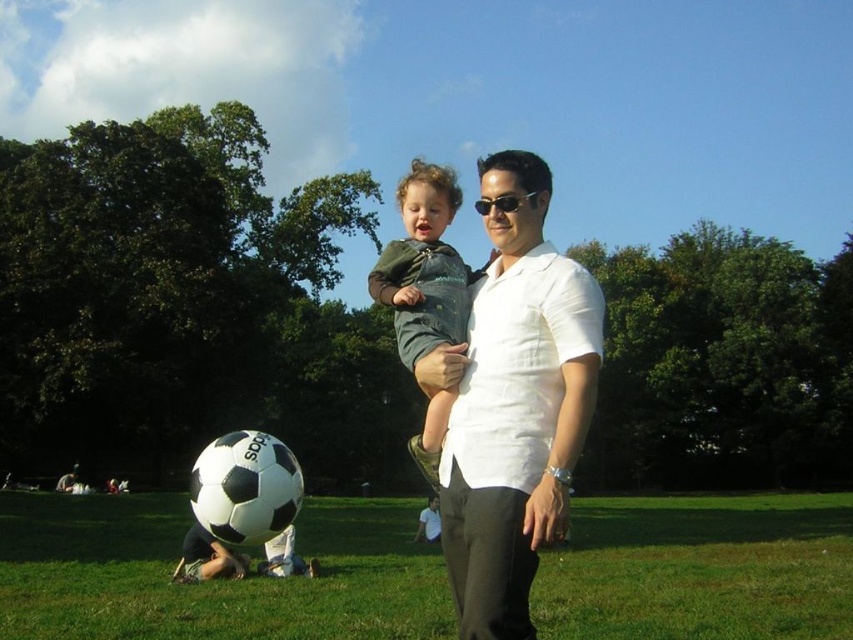
You are planning to lay down a picnic blanket in the park. Given the scene, which area would be more suitable for placing the blanket without overlapping any clothing items? Please choose between the green grass at lower center and the green denim overalls at center based on their sizes.

The green grass at lower center has a larger width than the green denim overalls at center, making it more suitable for placing the picnic blanket without overlapping clothing items.

You are standing at the point with coordinates point [495,557] and want to walk towards the point with coordinates point [410,362]. Which direction should you move relative to the scene?

You should move backward because point [495,557] is in front of point [410,362], so moving backward will take you toward the desired point.